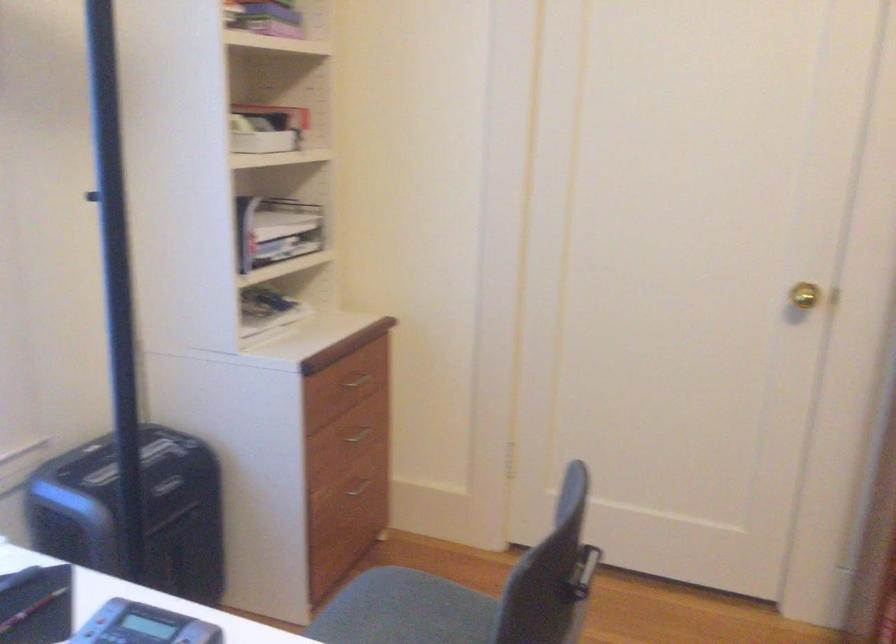
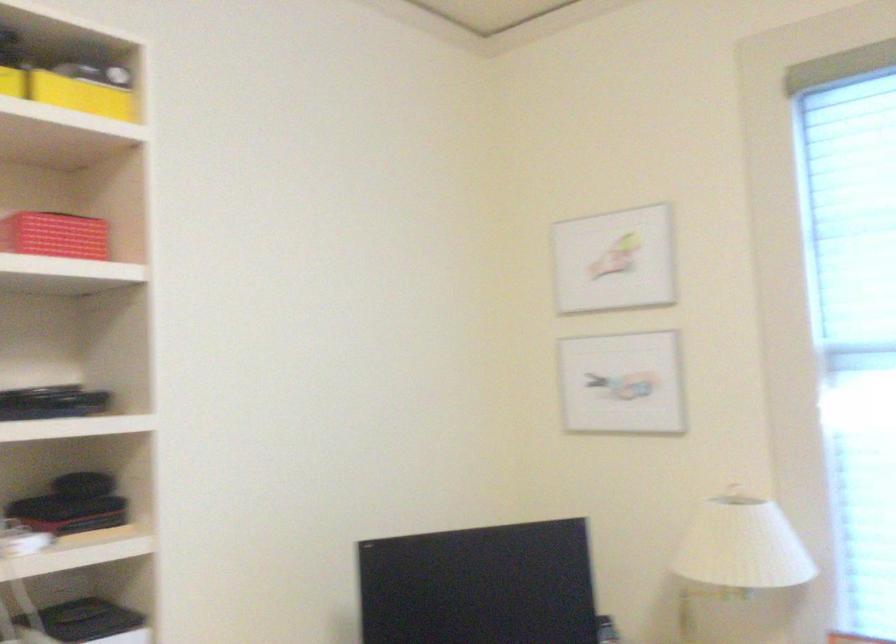
Question: The images are taken continuously from a first-person perspective. In which direction is your viewpoint rotating?

Choices:
 (A) Left
 (B) Right
 (C) Up
 (D) Down

Answer: (A)